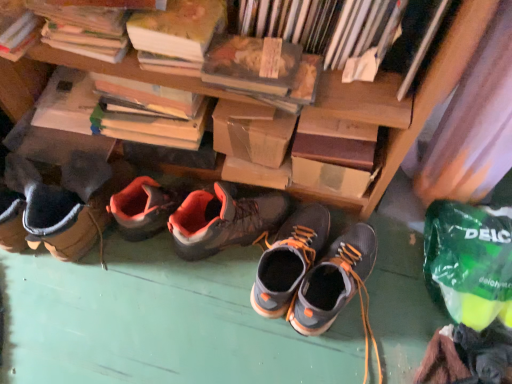
Find the location of a particular element. The image size is (512, 384). free location in front of matte gray and orange hiking boots at center, acting as the 1th footwear starting from the right is located at coordinates (340, 349).